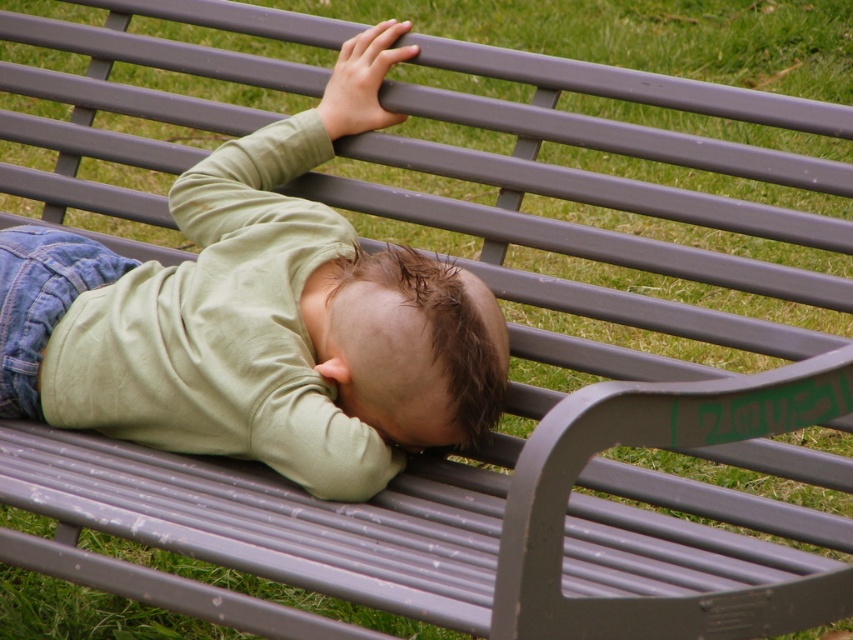
Is matte green shirt at center below matte gray bench at upper center?

Yes, matte green shirt at center is below matte gray bench at upper center.

Between matte green shirt at center and matte gray bench at upper center, which one is positioned lower?

matte green shirt at center is lower down.

Does point (230, 368) come behind point (331, 108)?

No, it is in front of (331, 108).

Identify the location of matte green shirt at center. The image size is (853, 640). (259, 317).

The width and height of the screenshot is (853, 640). What do you see at coordinates (259, 317) in the screenshot?
I see `matte green shirt at center` at bounding box center [259, 317].

Who is lower down, matte green shirt at center or brown matte hair at center?

brown matte hair at center is below.

Is point (387, 45) closer to viewer compared to point (315, 321)?

No, it is behind (315, 321).

Locate an element on the screen. The width and height of the screenshot is (853, 640). matte green shirt at center is located at coordinates (259, 317).

Which is more to the left, brown matte hair at center or matte gray bench at upper center?

matte gray bench at upper center

Between point (415, 384) and point (384, 36), which one is positioned behind?

The point (384, 36) is more distant.

Locate an element on the screen. The image size is (853, 640). brown matte hair at center is located at coordinates 408,346.